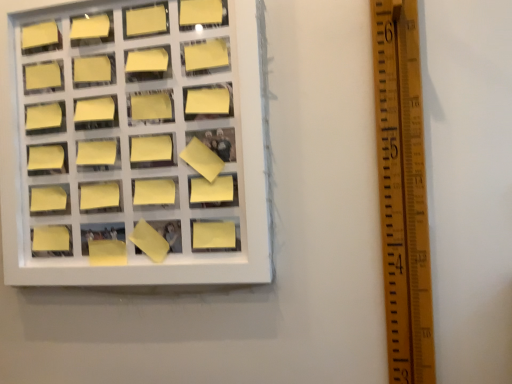
Question: Does yellow matte sticky note at center-left, the third square in the bottom-to-top sequence, come behind yellow matte sticky note at upper left, arranged as the 8th square when ordered from the bottom?

Choices:
 (A) no
 (B) yes

Answer: (A)

Question: From a real-world perspective, is yellow matte sticky note at center-left, which is the 9th square in top-to-bottom order, beneath yellow matte sticky note at upper left, marked as the 4th square in a top-to-bottom arrangement?

Choices:
 (A) yes
 (B) no

Answer: (A)

Question: Is yellow matte sticky note at center-left, which is the 9th square in top-to-bottom order, smaller than yellow matte sticky note at upper left, marked as the 4th square in a top-to-bottom arrangement?

Choices:
 (A) no
 (B) yes

Answer: (A)

Question: Can you confirm if yellow matte sticky note at center-left, the third square in the bottom-to-top sequence, is thinner than yellow matte sticky note at upper left, marked as the 4th square in a top-to-bottom arrangement?

Choices:
 (A) no
 (B) yes

Answer: (A)

Question: Is yellow matte sticky note at center-left, the third square in the bottom-to-top sequence, shorter than yellow matte sticky note at upper left, marked as the 4th square in a top-to-bottom arrangement?

Choices:
 (A) yes
 (B) no

Answer: (B)

Question: Is yellow matte sticky note at center-left, the third square in the bottom-to-top sequence, located outside yellow matte sticky note at upper left, marked as the 4th square in a top-to-bottom arrangement?

Choices:
 (A) yes
 (B) no

Answer: (A)

Question: From the image's perspective, is yellow matte sticky note at upper left, acting as the 4th square starting from the bottom, below yellow matte sticky note at upper left, arranged as the 8th square when ordered from the bottom?

Choices:
 (A) yes
 (B) no

Answer: (A)

Question: From the image's perspective, is yellow matte sticky note at upper left, which is the 8th square in top-to-bottom order, on top of yellow matte sticky note at upper left, marked as the 4th square in a top-to-bottom arrangement?

Choices:
 (A) yes
 (B) no

Answer: (B)

Question: Are yellow matte sticky note at upper left, which is the 8th square in top-to-bottom order, and yellow matte sticky note at upper left, marked as the 4th square in a top-to-bottom arrangement, located far from each other?

Choices:
 (A) no
 (B) yes

Answer: (A)

Question: Does yellow matte sticky note at upper left, which is the 8th square in top-to-bottom order, contain yellow matte sticky note at upper left, arranged as the 8th square when ordered from the bottom?

Choices:
 (A) no
 (B) yes

Answer: (A)

Question: Does yellow matte sticky note at upper left, acting as the 4th square starting from the bottom, turn towards yellow matte sticky note at upper left, marked as the 4th square in a top-to-bottom arrangement?

Choices:
 (A) yes
 (B) no

Answer: (B)

Question: Is yellow matte sticky note at upper left, which is the 8th square in top-to-bottom order, located outside yellow matte sticky note at upper left, marked as the 4th square in a top-to-bottom arrangement?

Choices:
 (A) no
 (B) yes

Answer: (B)

Question: Is yellow matte sticky note at upper center, placed as the 3th square when sorted from top to bottom, located within yellow matte sticky note at center-left, the third square in the bottom-to-top sequence?

Choices:
 (A) yes
 (B) no

Answer: (B)